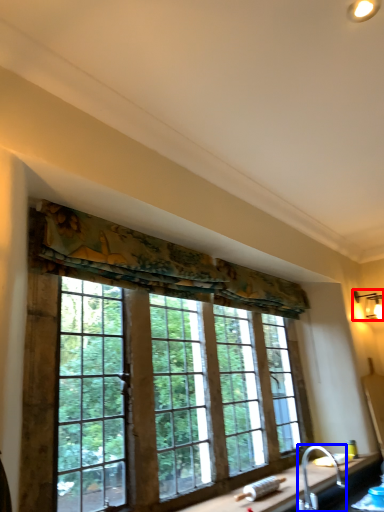
Question: Which of the following is the closest to the observer, light fixture (highlighted by a red box) or faucet (highlighted by a blue box)?

Choices:
 (A) light fixture
 (B) faucet

Answer: (B)